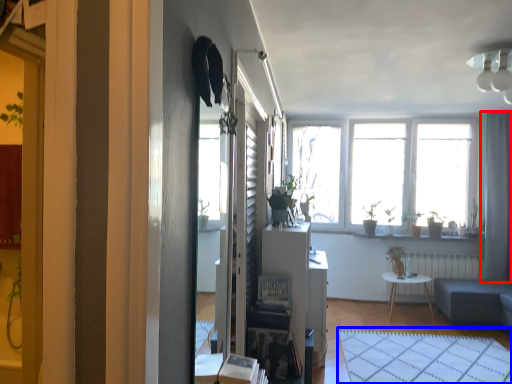
Question: Which object appears closest to the camera in this image, curtain (highlighted by a red box) or plain (highlighted by a blue box)?

Choices:
 (A) curtain
 (B) plain

Answer: (B)